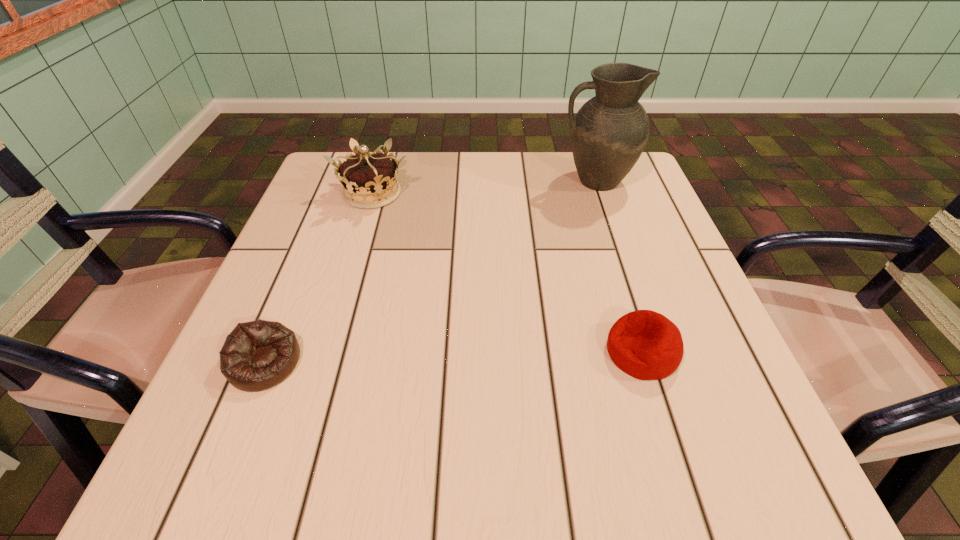
At what (x,y) coordinates should I click in order to perform the action: click on object present at the far left corner. Please return your answer as a coordinate pair (x, y). This screenshot has height=540, width=960. Looking at the image, I should click on (369, 180).

Where is `object positioned at the far right corner`? This screenshot has width=960, height=540. object positioned at the far right corner is located at coordinates (610, 131).

In the image, there is a desktop. Where is `vacant space at the far edge`? The width and height of the screenshot is (960, 540). vacant space at the far edge is located at coordinates (445, 156).

At what (x,y) coordinates should I click in order to perform the action: click on vacant region at the near edge of the desktop. Please return your answer as a coordinate pair (x, y). This screenshot has height=540, width=960. Looking at the image, I should click on (423, 462).

At what (x,y) coordinates should I click in order to perform the action: click on free location at the left edge. Please return your answer as a coordinate pair (x, y). The width and height of the screenshot is (960, 540). Looking at the image, I should click on (277, 310).

Identify the location of blank space at the right edge of the desktop. (628, 211).

Identify the location of vacant space at the far left corner of the desktop. (331, 172).

This screenshot has width=960, height=540. In the image, there is a desktop. In order to click on vacant space at the near left corner in this screenshot , I will do `click(283, 482)`.

The image size is (960, 540). In the image, there is a desktop. Identify the location of vacant area at the far right corner. (641, 195).

At what (x,y) coordinates should I click in order to perform the action: click on vacant area that lies between the shortest object and the taller beanbag. Please return your answer as a coordinate pair (x, y). This screenshot has width=960, height=540. Looking at the image, I should click on (453, 357).